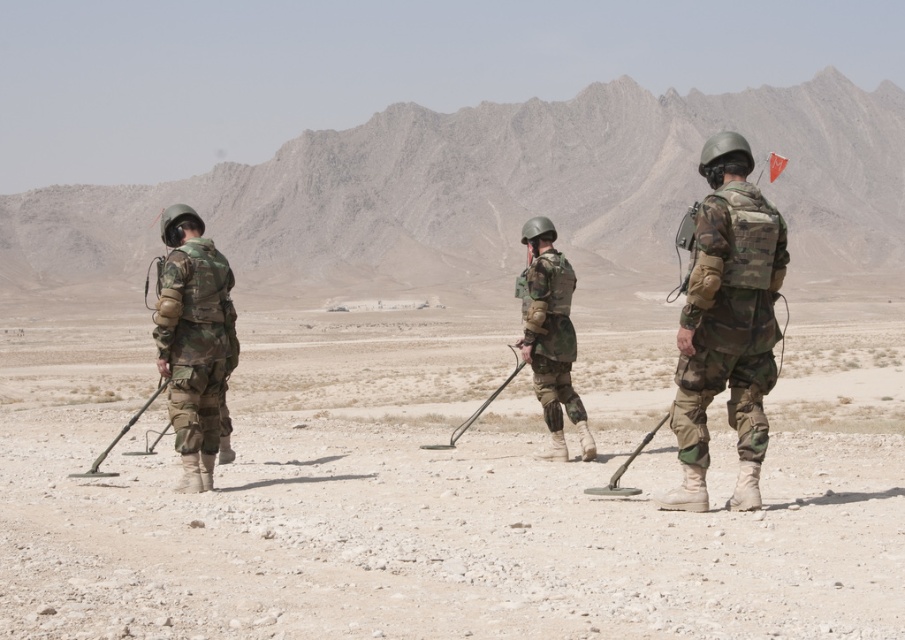
Question: Which object is farther from the camera taking this photo?

Choices:
 (A) camouflage fabric vest at right
 (B) metallic black metal detector at center
 (C) metallic gray metal detector at left
 (D) camouflage fabric helmet at center

Answer: (B)

Question: Which object appears farthest from the camera in this image?

Choices:
 (A) camouflage fabric helmet at center
 (B) camouflage fabric helmet at left
 (C) camouflage fabric vest at right

Answer: (A)

Question: Among these objects, which one is nearest to the camera?

Choices:
 (A) camouflage fabric helmet at center
 (B) camouflage fabric vest at right
 (C) metallic black metal detector at center
 (D) metallic gray metal detector at left

Answer: (B)

Question: Does camouflage fabric helmet at center appear on the left side of metallic smooth detector at center?

Choices:
 (A) no
 (B) yes

Answer: (B)

Question: Does dull brown dirt at center have a larger size compared to metallic black metal detector at center?

Choices:
 (A) no
 (B) yes

Answer: (B)

Question: Can you confirm if camouflage fabric helmet at center is smaller than metallic smooth detector at center?

Choices:
 (A) yes
 (B) no

Answer: (A)